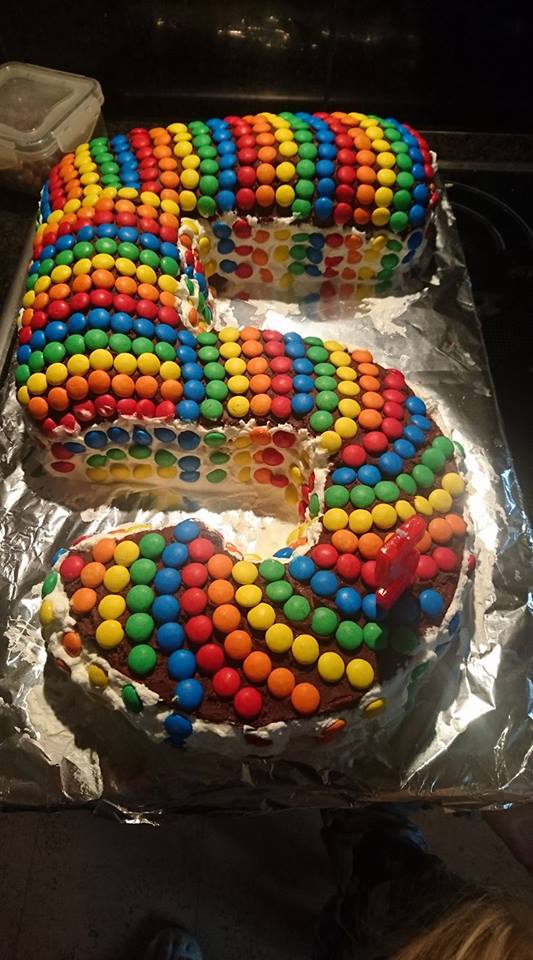
Find the location of `plastic cover on glass container`. plastic cover on glass container is located at coordinates (36, 100).